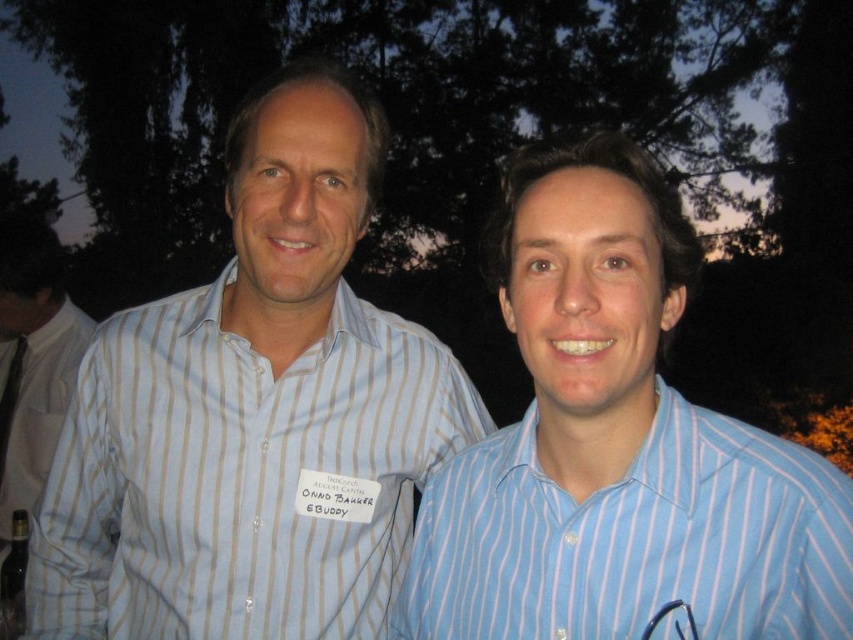
Is blue striped shirt at center below white striped shirt at left?

Incorrect, blue striped shirt at center is not positioned below white striped shirt at left.

Where is `blue striped shirt at center`? blue striped shirt at center is located at coordinates (618, 445).

Is light blue striped shirt at center wider than white striped shirt at left?

No, light blue striped shirt at center is not wider than white striped shirt at left.

Is light blue striped shirt at center smaller than white striped shirt at left?

Yes.

The image size is (853, 640). I want to click on light blue striped shirt at center, so click(x=253, y=413).

You are a GUI agent. You are given a task and a screenshot of the screen. Output one action in this format:
    pyautogui.click(x=<x>, y=<y>)
    Task: Click on the light blue striped shirt at center
    
    Given the screenshot: What is the action you would take?
    pyautogui.click(x=253, y=413)

Which is in front, point (202, 474) or point (618, 538)?

Positioned in front is point (618, 538).

Is light blue striped shirt at center to the right of blue striped shirt at center from the viewer's perspective?

Incorrect, light blue striped shirt at center is not on the right side of blue striped shirt at center.

You are a GUI agent. You are given a task and a screenshot of the screen. Output one action in this format:
    pyautogui.click(x=<x>, y=<y>)
    Task: Click on the light blue striped shirt at center
    
    Given the screenshot: What is the action you would take?
    pyautogui.click(x=253, y=413)

Where is `light blue striped shirt at center`? Image resolution: width=853 pixels, height=640 pixels. light blue striped shirt at center is located at coordinates (253, 413).